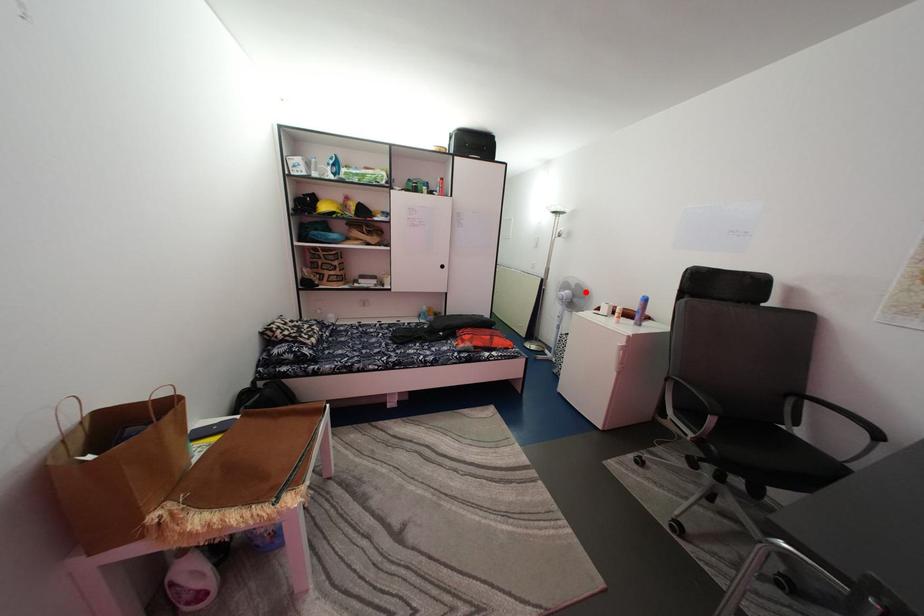
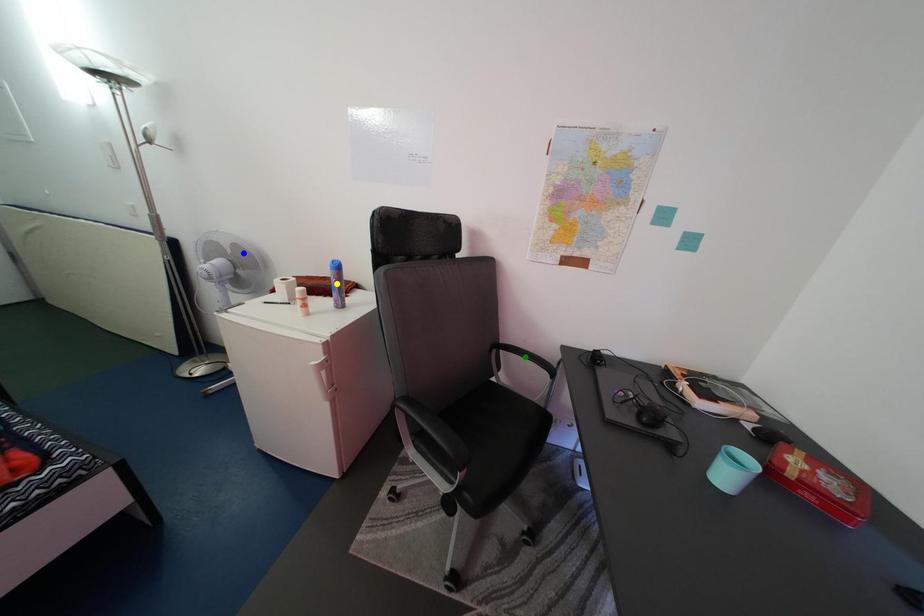
Question: I am providing you with two images of the same scene from different viewpoints. A red point is marked on the first image. You are given multiple points on the second image. Which point in image 2 is actually the same real-world point as the red point in image 1?

Choices:
 (A) blue point
 (B) yellow point
 (C) green point

Answer: (A)